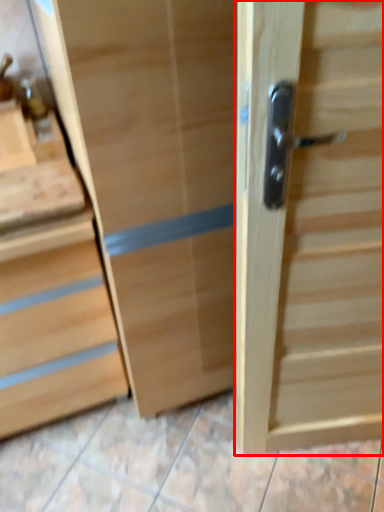
Question: From the image's perspective, considering the relative positions of door (annotated by the red box) and chest of drawers in the image provided, where is door (annotated by the red box) located with respect to the staircase?

Choices:
 (A) below
 (B) above

Answer: (B)